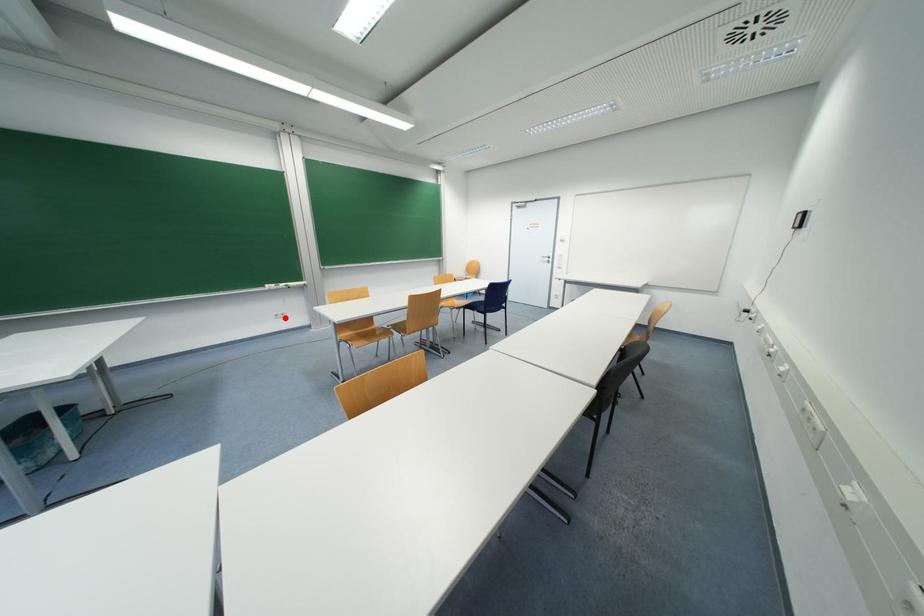
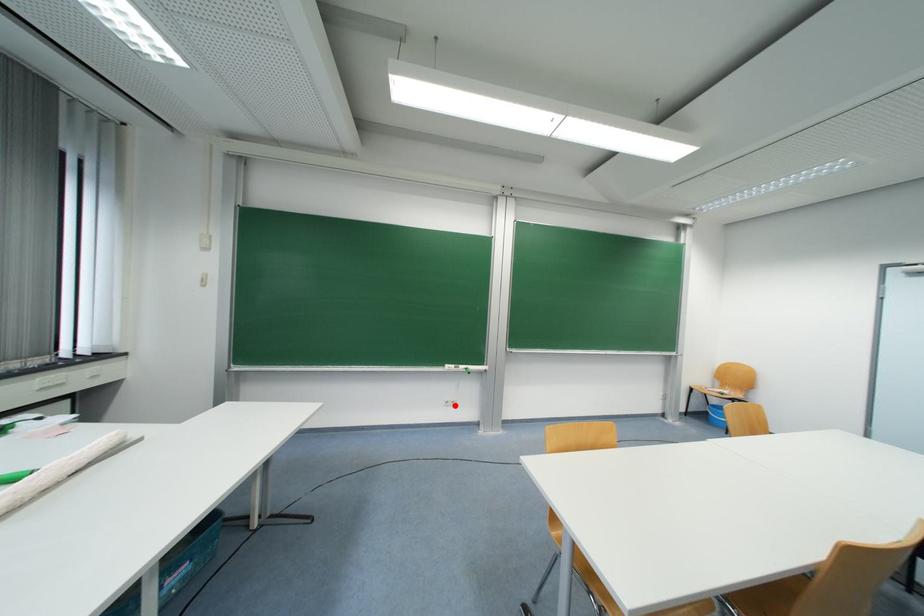
I am providing you with two images of the same scene from different viewpoints. A red point is marked on the first image and another point is marked on the second image. Is the marked point in image1 the same physical position as the marked point in image2?

Yes